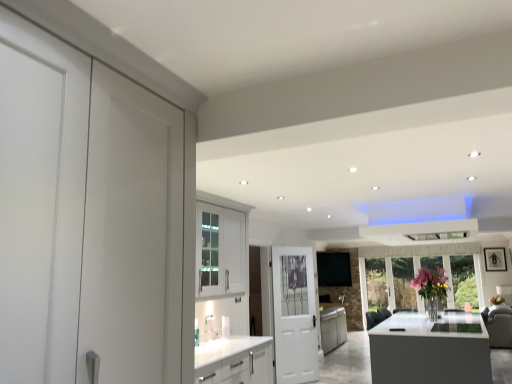
At what (x,y) coordinates should I click in order to perform the action: click on white glossy door at center. Please return your answer as a coordinate pair (x, y). Looking at the image, I should click on (x=294, y=315).

Measure the distance between point (293, 303) and camera.

5.75 meters.

Describe the element at coordinates (294, 315) in the screenshot. The image size is (512, 384). I see `white glossy door at center` at that location.

What do you see at coordinates (430, 283) in the screenshot?
I see `pink glass vase at center` at bounding box center [430, 283].

You are a GUI agent. You are given a task and a screenshot of the screen. Output one action in this format:
    pyautogui.click(x=<x>, y=<y>)
    Task: Click on the pink glass vase at center
    The width and height of the screenshot is (512, 384).
    Given the screenshot: What is the action you would take?
    pyautogui.click(x=430, y=283)

At what (x,y) coordinates should I click in order to perform the action: click on white glossy door at center. Please return your answer as a coordinate pair (x, y). This screenshot has height=384, width=512. Looking at the image, I should click on (294, 315).

In the scene shown: Is pink glass vase at center to the right of white glossy door at center from the viewer's perspective?

Yes.

Is pink glass vase at center in front of or behind white glossy door at center in the image?

Clearly, pink glass vase at center is in front of white glossy door at center.

Which is farther, (426, 278) or (295, 288)?

The point (426, 278) is behind.

From the image's perspective, is pink glass vase at center located above or below white glossy door at center?

Based on their image positions, pink glass vase at center is located above white glossy door at center.

From a real-world perspective, between pink glass vase at center and white glossy door at center, who is vertically higher?

pink glass vase at center is physically above.

Can you confirm if pink glass vase at center is thinner than white glossy door at center?

No, pink glass vase at center is not thinner than white glossy door at center.

In the scene shown: Between pink glass vase at center and white glossy door at center, which one has less height?

Standing shorter between the two is pink glass vase at center.

Is pink glass vase at center bigger or smaller than white glossy door at center?

In the image, pink glass vase at center appears to be smaller than white glossy door at center.

Is pink glass vase at center positioned beyond the bounds of white glossy door at center?

Yes, pink glass vase at center is outside of white glossy door at center.

Based on the photo, is pink glass vase at center beside white glossy door at center?

No, pink glass vase at center is not in contact with white glossy door at center.

Is white glossy door at center at the back of pink glass vase at center?

No, pink glass vase at center is not facing away from white glossy door at center.

Can you tell me how much pink glass vase at center and white glossy door at center differ in facing direction?

147 degrees separate the facing orientations of pink glass vase at center and white glossy door at center.

Find the location of a particular element. door behind the pink glass vase at center is located at coordinates (294, 315).

Is white glossy door at center at the right side of pink glass vase at center?

No, white glossy door at center is not to the right of pink glass vase at center.

Is white glossy door at center further to the viewer compared to pink glass vase at center?

Yes, it is.

Does point (285, 257) appear closer or farther from the camera than point (442, 287)?

Point (285, 257) appears to be closer to the viewer than point (442, 287).

From the image's perspective, is white glossy door at center above or below pink glass vase at center?

white glossy door at center is situated lower than pink glass vase at center in the image.

From a real-world perspective, is white glossy door at center located beneath pink glass vase at center?

Yes.

Does white glossy door at center have a lesser width compared to pink glass vase at center?

Yes.

Does white glossy door at center have a lesser height compared to pink glass vase at center?

In fact, white glossy door at center may be taller than pink glass vase at center.

Does white glossy door at center have a larger size compared to pink glass vase at center?

Indeed, white glossy door at center has a larger size compared to pink glass vase at center.

Is white glossy door at center not inside pink glass vase at center?

Yes, white glossy door at center is not within pink glass vase at center.

Is white glossy door at center far away from pink glass vase at center?

Indeed, white glossy door at center is not near pink glass vase at center.

Is white glossy door at center turned away from pink glass vase at center?

No, white glossy door at center is not facing the opposite direction of pink glass vase at center.

How much distance is there between white glossy door at center and pink glass vase at center?

white glossy door at center is 8.94 feet away from pink glass vase at center.

The height and width of the screenshot is (384, 512). Identify the location of flower that appears on the right of white glossy door at center. (430, 283).

Locate an element on the screen. The height and width of the screenshot is (384, 512). flower above the white glossy door at center (from a real-world perspective) is located at coordinates (430, 283).

The width and height of the screenshot is (512, 384). Find the location of `door that is below the pink glass vase at center (from the image's perspective)`. door that is below the pink glass vase at center (from the image's perspective) is located at coordinates (294, 315).